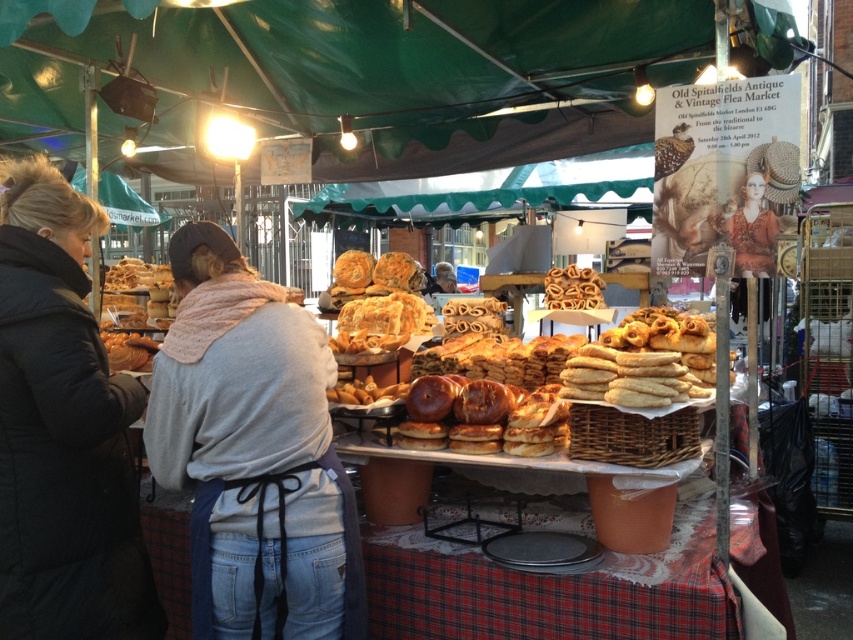
From the picture: You are standing at the point marked by the coordinate point at point [419,310]. You want to reach the entrance of the Old Spitalfields Antique and Vintage Flea Market stall. The entrance is located at the opposite side of the sign mentioned in the scene description. If you walk straight towards the entrance, will you have enough space to pass through the narrowest part of the path between the two points, which is 4.10 meters wide? Please answer yes or no.

The narrowest part of the path between the point marked by the coordinate point at point [419,310] and the entrance is 4.10 meters wide. Since the path is 4.10 meters wide, you have enough space to pass through.

You are a customer at the Old Spitalfields Antique Market and want to pick up both the light gray fleece jacket at center and the black puffy jacket at left. Which jacket should you approach first to reach it without walking around the stall?

You should approach the light gray fleece jacket at center first because it is closer to you than the black puffy jacket at left, which is further away.